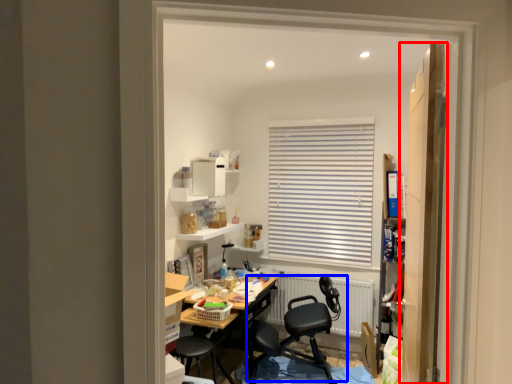
Question: Which object appears farthest to the camera in this image, door (highlighted by a red box) or chair (highlighted by a blue box)?

Choices:
 (A) door
 (B) chair

Answer: (B)